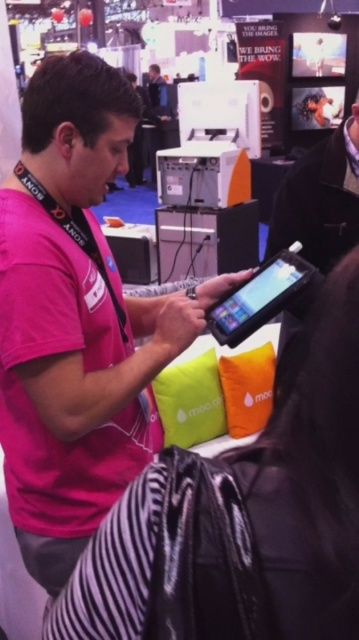
Image resolution: width=359 pixels, height=640 pixels. What do you see at coordinates (76, 320) in the screenshot?
I see `pink matte shirt at center` at bounding box center [76, 320].

Measure the distance between pink matte shirt at center and matte green pillow at center.

65.27 centimeters

Identify the location of pink matte shirt at center. The height and width of the screenshot is (640, 359). (76, 320).

Can you confirm if black plastic tablet at center is positioned to the right of matte green pillow at center?

Correct, you'll find black plastic tablet at center to the right of matte green pillow at center.

Does black plastic tablet at center have a greater height compared to matte green pillow at center?

No, black plastic tablet at center is not taller than matte green pillow at center.

Is point (222, 333) closer to camera compared to point (199, 420)?

Yes, point (222, 333) is in front of point (199, 420).

Where is `black plastic tablet at center`? black plastic tablet at center is located at coordinates (259, 298).

From the picture: Who is more distant from viewer, [59,314] or [210,544]?

The point [59,314] is more distant.

Does pink matte shirt at center appear over matte black tablet at center?

Indeed, pink matte shirt at center is positioned over matte black tablet at center.

Who is more distant from viewer, (43, 428) or (95, 586)?

The point (43, 428) is more distant.

Identify the location of pink matte shirt at center. The height and width of the screenshot is (640, 359). (76, 320).